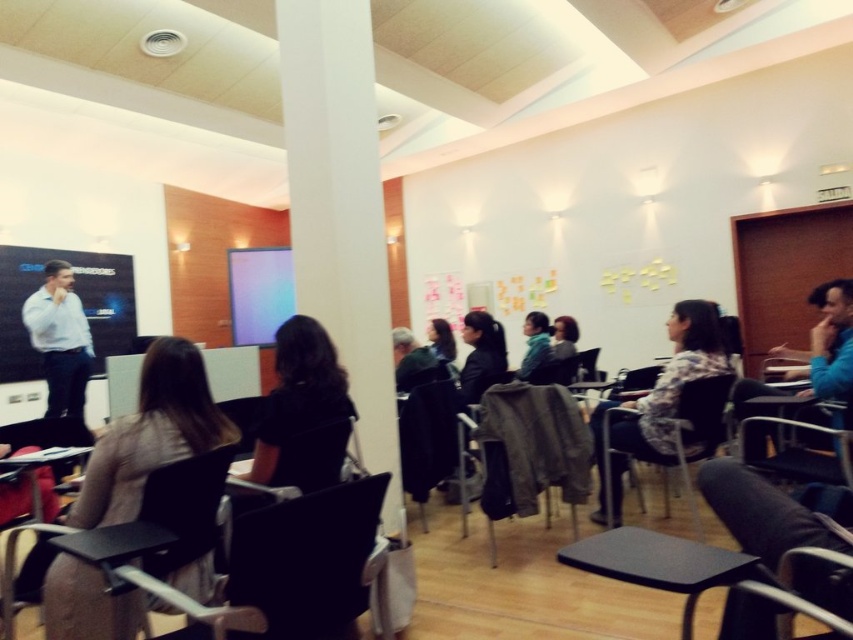
Is wooden chair at center to the left of black hair at center from the viewer's perspective?

Incorrect, wooden chair at center is not on the left side of black hair at center.

Can you confirm if wooden chair at center is positioned to the right of black hair at center?

Yes, wooden chair at center is to the right of black hair at center.

Image resolution: width=853 pixels, height=640 pixels. I want to click on wooden chair at center, so click(x=676, y=436).

What are the coordinates of `wooden chair at center` in the screenshot? It's located at point(676,436).

Is black plastic chair at lower center to the left of black plastic table at lower center from the viewer's perspective?

Yes, black plastic chair at lower center is to the left of black plastic table at lower center.

Can you confirm if black plastic chair at lower center is positioned below black plastic table at lower center?

Yes, black plastic chair at lower center is below black plastic table at lower center.

Does point (252, 586) come farther from viewer compared to point (695, 586)?

Yes, it is behind point (695, 586).

This screenshot has width=853, height=640. Identify the location of black plastic chair at lower center. (303, 566).

Is matte blue screen at center thinner than black hair at center?

In fact, matte blue screen at center might be wider than black hair at center.

Is matte blue screen at center below black hair at center?

No.

This screenshot has height=640, width=853. Describe the element at coordinates (259, 292) in the screenshot. I see `matte blue screen at center` at that location.

Locate an element on the screen. The width and height of the screenshot is (853, 640). matte blue screen at center is located at coordinates (259, 292).